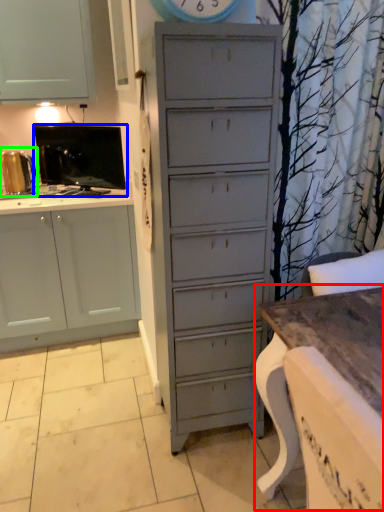
Question: Estimate the real-world distances between objects in this image. Which object is closer to table (highlighted by a red box), appliance (highlighted by a blue box) or appliance (highlighted by a green box)?

Choices:
 (A) appliance
 (B) appliance

Answer: (A)